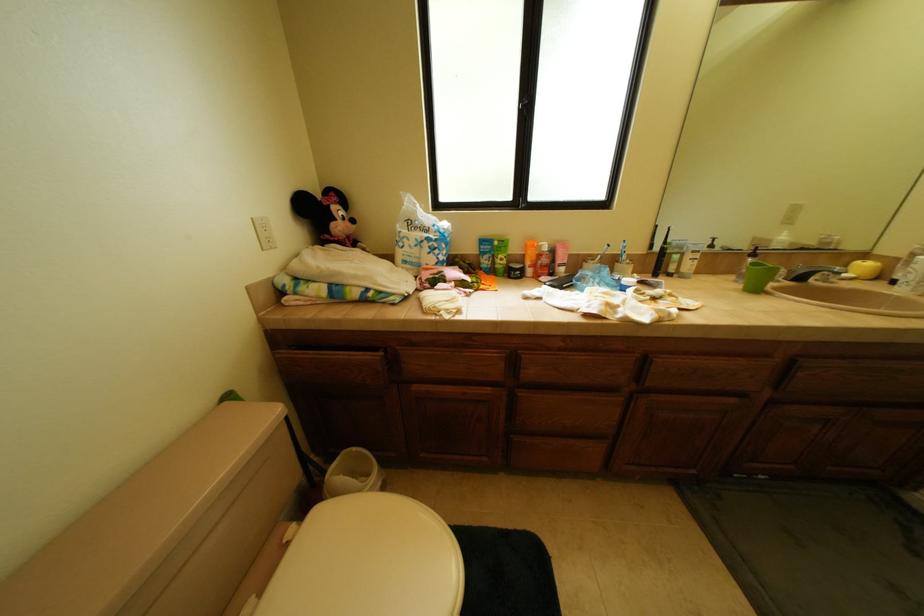
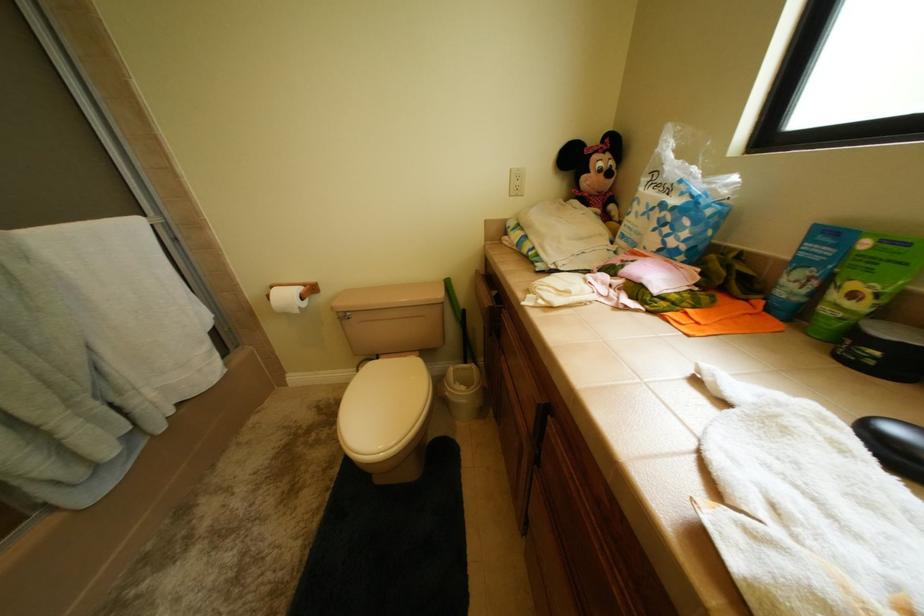
First-person continuous shooting, in which direction is the camera rotating?

The camera's rotation is toward left-down.